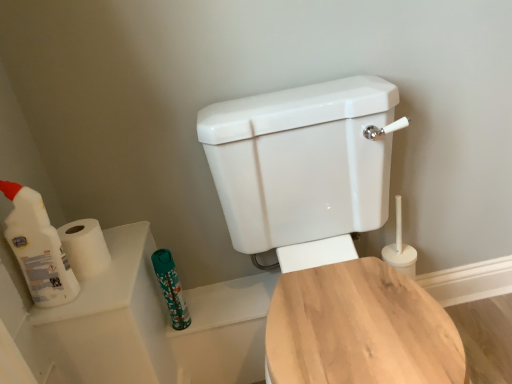
Question: From a real-world perspective, is white matte toilet paper at left above or below white glossy toilet at center, acting as the 1th toilet starting from the front?

Choices:
 (A) below
 (B) above

Answer: (B)

Question: Is white matte toilet paper at left spatially inside white glossy toilet at center, placed as the 2th toilet when sorted from back to front, or outside of it?

Choices:
 (A) outside
 (B) inside

Answer: (A)

Question: Which is farther from the wooden toilet seat at center, which is the second toilet in front-to-back order?

Choices:
 (A) teal fabric toiletry at lower center
 (B) white matte toilet paper at left
 (C) white plastic bottle at left
 (D) white glossy toilet at center, acting as the 1th toilet starting from the front

Answer: (C)

Question: Which object is the farthest from the teal fabric toiletry at lower center?

Choices:
 (A) white matte toilet paper at left
 (B) wooden toilet seat at center, which is the second toilet in front-to-back order
 (C) white plastic bottle at left
 (D) white glossy toilet at center, acting as the 1th toilet starting from the front

Answer: (B)